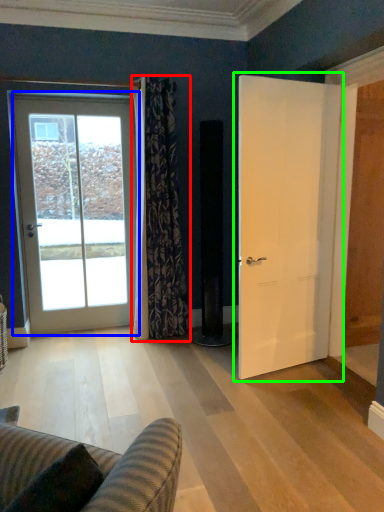
Question: Estimate the real-world distances between objects in this image. Which object is closer to curtain (highlighted by a red box), door (highlighted by a blue box) or door (highlighted by a green box)?

Choices:
 (A) door
 (B) door

Answer: (A)